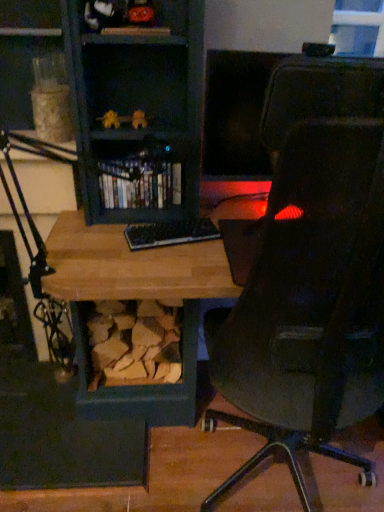
Identify the location of black plastic keyboard at center. (170, 233).

This screenshot has width=384, height=512. In order to click on shiny plastic books at center in this screenshot , I will do `click(139, 183)`.

Image resolution: width=384 pixels, height=512 pixels. Find the location of `transparent glass window at upper right`. transparent glass window at upper right is located at coordinates (358, 27).

Where is `black plastic keyboard at center`? black plastic keyboard at center is located at coordinates (x=170, y=233).

Is shiny plastic books at center facing away from transparent glass window at upper right?

shiny plastic books at center is not turned away from transparent glass window at upper right.

This screenshot has width=384, height=512. In order to click on book below the transparent glass window at upper right (from the image's perspective) in this screenshot , I will do `click(139, 183)`.

Based on the photo, what's the angular difference between shiny plastic books at center and transparent glass window at upper right's facing directions?

shiny plastic books at center and transparent glass window at upper right are facing 0.779 degrees away from each other.

In the image, is shiny plastic books at center on the left side or the right side of transparent glass window at upper right?

In the image, shiny plastic books at center appears on the left side of transparent glass window at upper right.

From a real-world perspective, between transparent glass window at upper right and black plastic keyboard at center, who is vertically lower?

From a 3D spatial view, black plastic keyboard at center is below.

From the image's perspective, is transparent glass window at upper right beneath black plastic keyboard at center?

No.

Is point (344, 12) positioned before point (194, 231)?

No.

Would you say black plastic keyboard at center is to the left or to the right of transparent glass window at upper right in the picture?

black plastic keyboard at center is positioned on transparent glass window at upper right's left side.

From a real-world perspective, between black plastic keyboard at center and transparent glass window at upper right, who is vertically lower?

In real-world perspective, black plastic keyboard at center is lower.

Does shiny plastic books at center contain black plastic keyboard at center?

Actually, black plastic keyboard at center is outside shiny plastic books at center.

In the scene shown: Who is bigger, shiny plastic books at center or black plastic keyboard at center?

With larger size is shiny plastic books at center.

Is shiny plastic books at center turned away from black plastic keyboard at center?

No, black plastic keyboard at center is not at the back of shiny plastic books at center.

Is transparent glass window at upper right thinner than shiny plastic books at center?

Yes, transparent glass window at upper right is thinner than shiny plastic books at center.

How many degrees apart are the facing directions of transparent glass window at upper right and shiny plastic books at center?

transparent glass window at upper right and shiny plastic books at center are facing 0.779 degrees away from each other.

Which is nearer, (359, 32) or (152, 178)?

Point (359, 32) is farther from the camera than point (152, 178).

At what (x,y) coordinates should I click in order to perform the action: click on book below the transparent glass window at upper right (from the image's perspective). Please return your answer as a coordinate pair (x, y). Looking at the image, I should click on (139, 183).

From the image's perspective, would you say black plastic keyboard at center is shown under shiny plastic books at center?

Yes, from the image's perspective, black plastic keyboard at center is beneath shiny plastic books at center.

Does black plastic keyboard at center have a lesser width compared to shiny plastic books at center?

Indeed, black plastic keyboard at center has a lesser width compared to shiny plastic books at center.

From a real-world perspective, between black plastic keyboard at center and shiny plastic books at center, who is vertically lower?

black plastic keyboard at center is physically lower.

Locate an element on the screen. This screenshot has height=512, width=384. window above the shiny plastic books at center (from a real-world perspective) is located at coordinates (358, 27).

This screenshot has width=384, height=512. Find the location of `keyboard on the left of transparent glass window at upper right`. keyboard on the left of transparent glass window at upper right is located at coordinates (170, 233).

Based on their spatial positions, is transparent glass window at upper right or black plastic keyboard at center further from shiny plastic books at center?

Among the two, transparent glass window at upper right is located further to shiny plastic books at center.

Looking at the image, which one is located further to transparent glass window at upper right, black plastic keyboard at center or shiny plastic books at center?

black plastic keyboard at center is positioned further to the anchor transparent glass window at upper right.

From the image, which object appears to be nearer to black plastic keyboard at center, transparent glass window at upper right or shiny plastic books at center?

shiny plastic books at center.

From the image, which object appears to be nearer to black plastic keyboard at center, shiny plastic books at center or transparent glass window at upper right?

Based on the image, shiny plastic books at center appears to be nearer to black plastic keyboard at center.

From the picture: From the image, which object appears to be nearer to transparent glass window at upper right, shiny plastic books at center or black plastic keyboard at center?

Based on the image, shiny plastic books at center appears to be nearer to transparent glass window at upper right.

Based on their spatial positions, is black plastic keyboard at center or transparent glass window at upper right further from shiny plastic books at center?

→ Based on the image, transparent glass window at upper right appears to be further to shiny plastic books at center.

This screenshot has height=512, width=384. In order to click on keyboard between shiny plastic books at center and transparent glass window at upper right from left to right in this screenshot , I will do `click(170, 233)`.